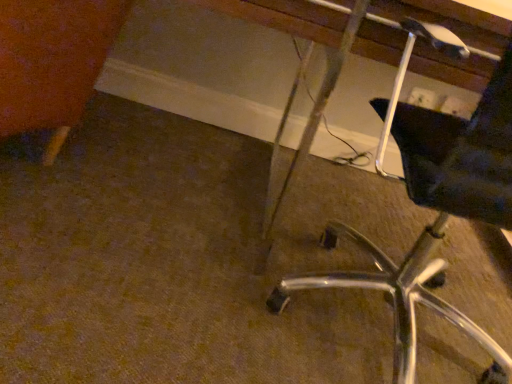
Question: Is metallic silver vanity at lower right wider or thinner than black fabric chair at right?

Choices:
 (A) thin
 (B) wide

Answer: (B)

Question: Considering the positions of point (454, 246) and point (359, 286), is point (454, 246) closer or farther from the camera than point (359, 286)?

Choices:
 (A) closer
 (B) farther

Answer: (B)

Question: Based on their positions, is metallic silver vanity at lower right located to the left or right of black fabric chair at right?

Choices:
 (A) left
 (B) right

Answer: (A)

Question: In the image, is black fabric chair at right positioned in front of or behind metallic silver vanity at lower right?

Choices:
 (A) behind
 (B) front

Answer: (B)

Question: In terms of height, does black fabric chair at right look taller or shorter compared to metallic silver vanity at lower right?

Choices:
 (A) short
 (B) tall

Answer: (A)

Question: Considering the positions of black fabric chair at right and metallic silver vanity at lower right in the image, is black fabric chair at right bigger or smaller than metallic silver vanity at lower right?

Choices:
 (A) small
 (B) big

Answer: (A)

Question: From a real-world perspective, is black fabric chair at right positioned above or below metallic silver vanity at lower right?

Choices:
 (A) below
 (B) above

Answer: (B)